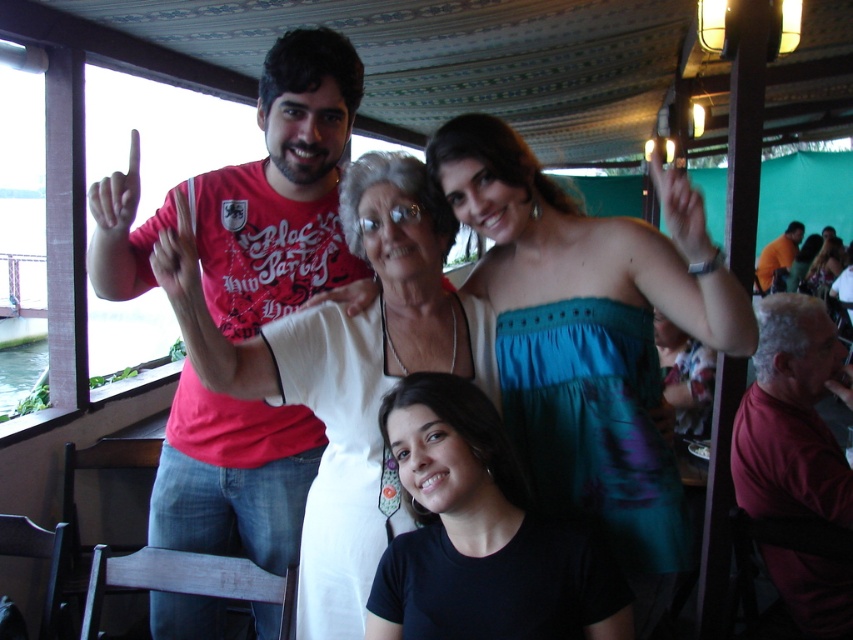
Does teal satin dress at center have a lesser height compared to black matte shirt at lower center?

No.

Between teal satin dress at center and black matte shirt at lower center, which one appears on the right side from the viewer's perspective?

From the viewer's perspective, teal satin dress at center appears more on the right side.

This screenshot has height=640, width=853. Identify the location of teal satin dress at center. (589, 333).

Can you confirm if black matte shirt at lower center is positioned above orange shirt at upper right?

Incorrect, black matte shirt at lower center is not positioned above orange shirt at upper right.

Between point (582, 554) and point (764, 285), which one is positioned behind?

Positioned behind is point (764, 285).

Is point (605, 593) farther from viewer compared to point (767, 262)?

No, (605, 593) is in front of (767, 262).

At what (x,y) coordinates should I click in order to perform the action: click on black matte shirt at lower center. Please return your answer as a coordinate pair (x, y). Looking at the image, I should click on (479, 534).

Who is shorter, black matte shirt at lower center or dark red shirt at right?

black matte shirt at lower center

Which is in front, point (508, 620) or point (792, 337)?

Positioned in front is point (508, 620).

I want to click on black matte shirt at lower center, so click(x=479, y=534).